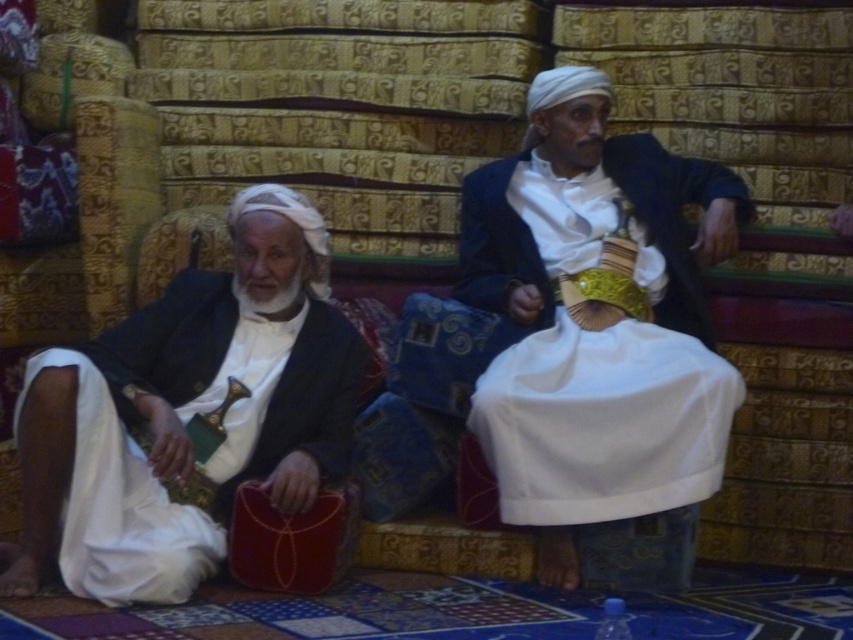
You are an interior designer assessing the placement of two black garments in a traditional setting. The scene includes a matte black jacket at center and a matte black suit at left. Based on their heights, which one might be more suitable for display on a tall stand versus a shorter shelf?

The matte black jacket at center is much taller than the matte black suit at left, so the matte black jacket at center would be better suited for a tall stand, while the matte black suit at left could be displayed on a shorter shelf.

You are an interior designer planning to place a wide sofa that requires 1.2 meters of space. You observe the matte black jacket at center and the matte black suit at left in the scene. Which object should you avoid placing the sofa next to to ensure sufficient space?

The matte black jacket at center has a lesser width compared to the matte black suit at left, so you should avoid placing the sofa next to the matte black suit at left to ensure there is enough space for the sofa.